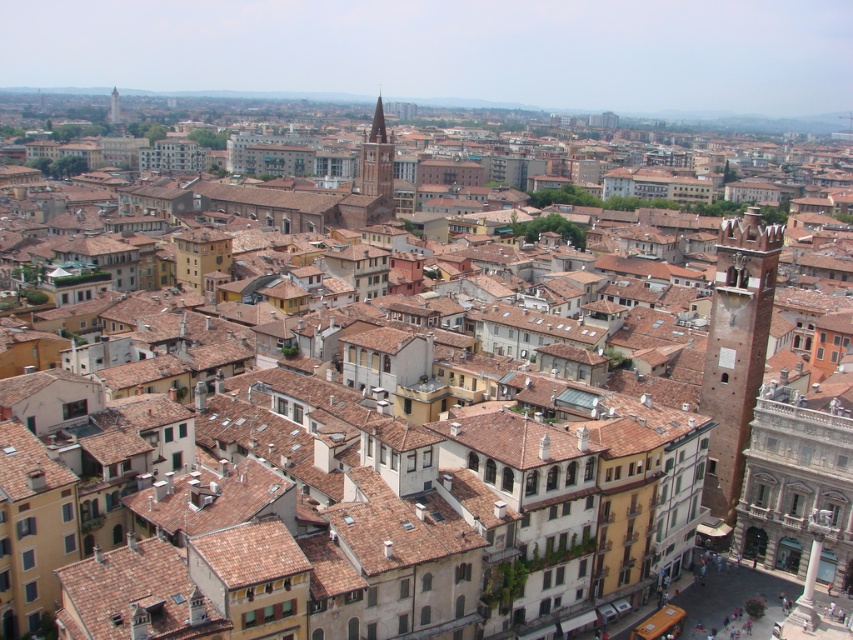
You are a city planner assessing the urban layout. You need to determine which of the two towers, the smooth stone tower at center or the light brown stone tower at upper center, has a greater width to accommodate more rooftop solar panels. Which tower should you choose?

The smooth stone tower at center has a greater width than the light brown stone tower at upper center, so you should choose the smooth stone tower at center to accommodate more rooftop solar panels.

You are a drone operator flying a drone over the city. You notice the brick tower at right and the light brown stone tower at upper center. Which tower is closer to your drone?

The brick tower at right is closer to the drone because it is in front of the light brown stone tower at upper center.

You are a tourist standing in the city square and want to take a photo of both the smooth stone tower at center and the light brown stone tower at upper center. Which tower should you position yourself closer to in order to capture both in the same frame?

You should position yourself closer to the smooth stone tower at center because it is located below the light brown stone tower at upper center, allowing both to be captured in the same frame when standing near the lower one.